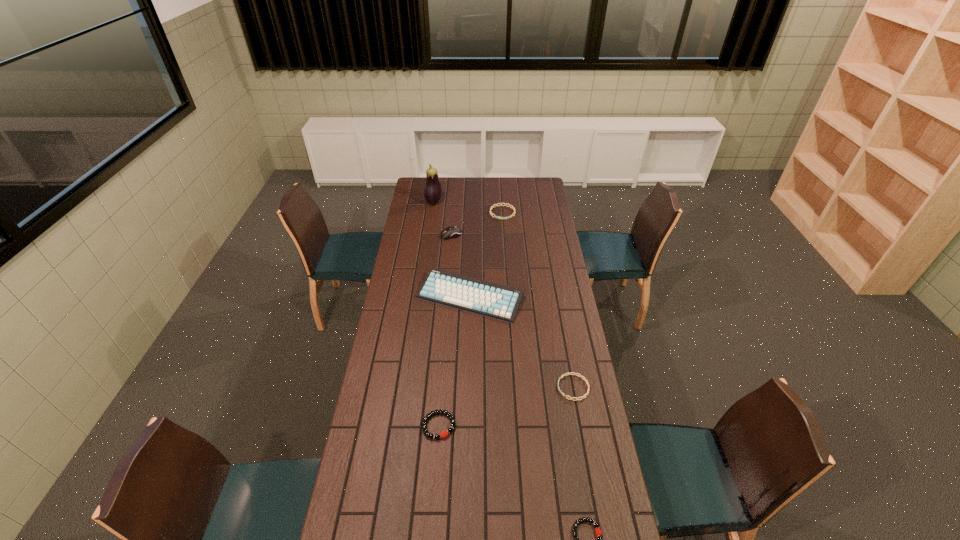
The image size is (960, 540). I want to click on eggplant at the left edge, so click(432, 193).

Locate an element on the screen. The image size is (960, 540). computer keyboard situated at the left edge is located at coordinates (498, 301).

This screenshot has width=960, height=540. I want to click on object that is at the right edge, so click(x=563, y=375).

Locate an element on the screen. This screenshot has width=960, height=540. object that is at the far left corner is located at coordinates (432, 193).

Find the location of a particular element. This screenshot has width=960, height=540. vacant space at the far edge of the desktop is located at coordinates [501, 181].

At what (x,y) coordinates should I click in order to perform the action: click on free location at the left edge. Please return your answer as a coordinate pair (x, y). This screenshot has width=960, height=540. Looking at the image, I should click on (396, 272).

Where is `vacant region at the right edge of the desktop`? This screenshot has width=960, height=540. vacant region at the right edge of the desktop is located at coordinates (568, 531).

Identify the location of vacant space at the far right corner. The image size is (960, 540). 536,192.

At what (x,y) coordinates should I click in order to perform the action: click on blank region between the second nearest bracelet and the eggplant. Please return your answer as a coordinate pair (x, y). The height and width of the screenshot is (540, 960). Looking at the image, I should click on (436, 314).

I want to click on free space between the bigger black bracelet and the nearer blue bracelet, so click(x=506, y=407).